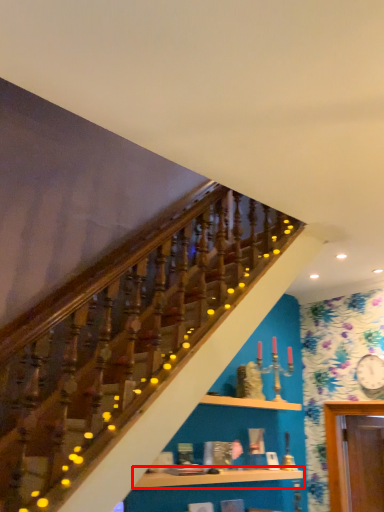
Question: From the image's perspective, where is shelf (annotated by the red box) located in relation to shelf in the image?

Choices:
 (A) below
 (B) above

Answer: (A)